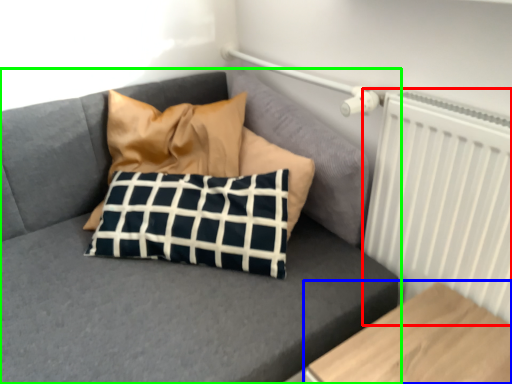
Question: Considering the real-world distances, which object is farthest from radiator (highlighted by a red box)? furniture (highlighted by a blue box) or studio couch (highlighted by a green box)?

Choices:
 (A) furniture
 (B) studio couch

Answer: (B)